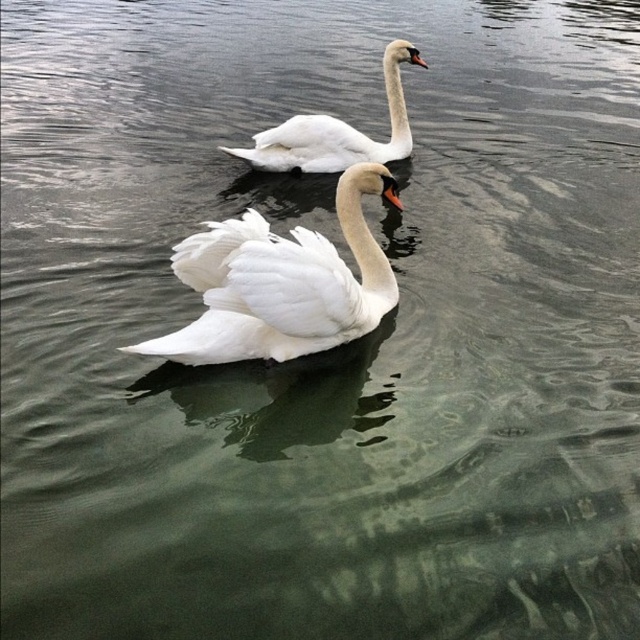
Between white feathered swan at center and white glossy swan at upper center, which one appears on the right side from the viewer's perspective?

white glossy swan at upper center

Does white feathered swan at center have a smaller size compared to white glossy swan at upper center?

Yes, white feathered swan at center is smaller than white glossy swan at upper center.

Is point (232, 220) less distant than point (278, 138)?

Yes, point (232, 220) is in front of point (278, 138).

At what (x,y) coordinates should I click in order to perform the action: click on white feathered swan at center. Please return your answer as a coordinate pair (x, y). This screenshot has height=640, width=640. Looking at the image, I should click on (282, 284).